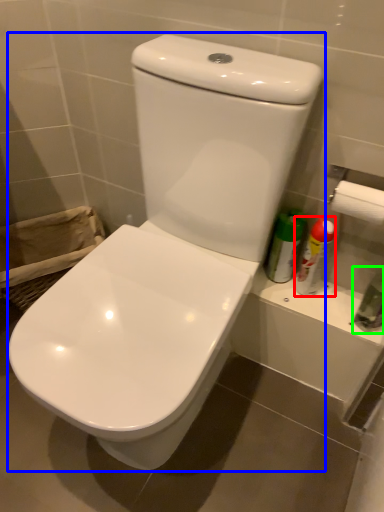
Question: Based on their relative distances, which object is nearer to cleaning product (highlighted by a red box)? Choose from toilet (highlighted by a blue box) and toiletry (highlighted by a green box).

Choices:
 (A) toilet
 (B) toiletry

Answer: (B)